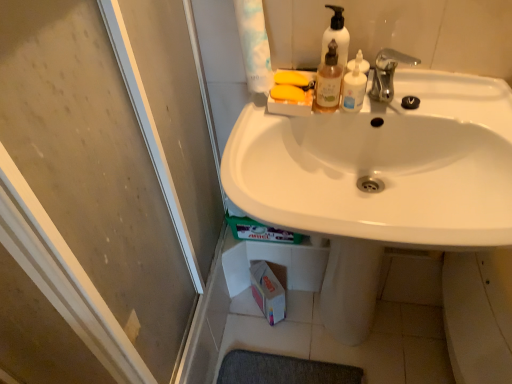
Describe the element at coordinates (254, 45) in the screenshot. I see `white glossy toilet paper at upper center` at that location.

Describe the element at coordinates (388, 73) in the screenshot. The image size is (512, 384). I see `silver metallic faucet at upper center` at that location.

Measure the distance between point [380,67] and camera.

The distance of point [380,67] from camera is 36.61 inches.

How much space does translucent plastic bottle at upper center, which appears as the second mouthwash when viewed from the right, occupy horizontally?

1.84 inches.

What is the approximate height of white plastic mouthwash at upper center, positioned as the first mouthwash in right-to-left order?

It is 3.99 inches.

This screenshot has width=512, height=384. What do you see at coordinates (101, 190) in the screenshot?
I see `transparent glass screen door at left` at bounding box center [101, 190].

What do you see at coordinates (336, 36) in the screenshot? I see `translucent plastic pump bottle at upper center` at bounding box center [336, 36].

The width and height of the screenshot is (512, 384). I want to click on white glossy toilet paper at upper center, so click(x=254, y=45).

From the image's perspective, which object appears higher, white glossy sink at center or white glossy toilet paper at upper center?

white glossy toilet paper at upper center is shown above in the image.

Who is taller, white glossy sink at center or white glossy toilet paper at upper center?

white glossy sink at center.

From a real-world perspective, is white glossy sink at center on top of white glossy toilet paper at upper center?

No.

Visually, is white glossy sink at center positioned to the left or to the right of white glossy toilet paper at upper center?

white glossy sink at center is positioned on white glossy toilet paper at upper center's right side.

Can you confirm if white glossy sink at center is bigger than translucent plastic pump bottle at upper center?

Yes.

Which object is thinner, white glossy sink at center or translucent plastic pump bottle at upper center?

translucent plastic pump bottle at upper center.

Considering the positions of points (381, 142) and (340, 15), is point (381, 142) closer to camera compared to point (340, 15)?

No.

Which object is positioned more to the left, white glossy sink at center or translucent plastic pump bottle at upper center?

translucent plastic pump bottle at upper center is more to the left.

From the picture: From the image's perspective, who appears lower, translucent plastic pump bottle at upper center or white plastic mouthwash at upper center, positioned as the first mouthwash in right-to-left order?

white plastic mouthwash at upper center, positioned as the first mouthwash in right-to-left order, appears lower in the image.

In terms of size, does translucent plastic pump bottle at upper center appear bigger or smaller than white plastic mouthwash at upper center, positioned as the first mouthwash in right-to-left order?

In the image, translucent plastic pump bottle at upper center appears to be larger than white plastic mouthwash at upper center, positioned as the first mouthwash in right-to-left order.

Which point is more forward, (325, 6) or (357, 88)?

The point (357, 88) is in front.

In terms of width, does translucent plastic pump bottle at upper center look wider or thinner when compared to white plastic mouthwash at upper center, which is the 2th mouthwash from left to right?

Considering their sizes, translucent plastic pump bottle at upper center looks broader than white plastic mouthwash at upper center, which is the 2th mouthwash from left to right.

Is translucent plastic bottle at upper center, which is the first mouthwash in left-to-right order, wider or thinner than transparent glass screen door at left?

Clearly, translucent plastic bottle at upper center, which is the first mouthwash in left-to-right order, has less width compared to transparent glass screen door at left.

Which object is closer to the camera taking this photo, translucent plastic bottle at upper center, which appears as the second mouthwash when viewed from the right, or transparent glass screen door at left?

transparent glass screen door at left is more forward.

The height and width of the screenshot is (384, 512). What are the coordinates of `screen door below the translucent plastic bottle at upper center, which is the first mouthwash in left-to-right order (from a real-world perspective)` in the screenshot? It's located at (101, 190).

Which of these two, translucent plastic bottle at upper center, which appears as the second mouthwash when viewed from the right, or transparent glass screen door at left, is smaller?

Smaller between the two is translucent plastic bottle at upper center, which appears as the second mouthwash when viewed from the right.

Looking at this image, which of these two, transparent glass screen door at left or translucent plastic pump bottle at upper center, is wider?

transparent glass screen door at left is wider.

Identify the location of screen door on the left side of translucent plastic pump bottle at upper center. This screenshot has width=512, height=384. (101, 190).

Considering the sizes of transparent glass screen door at left and translucent plastic pump bottle at upper center in the image, is transparent glass screen door at left taller or shorter than translucent plastic pump bottle at upper center?

Considering their sizes, transparent glass screen door at left has more height than translucent plastic pump bottle at upper center.

Identify the location of soap dispenser that appears above the translucent plastic bottle at upper center, which appears as the second mouthwash when viewed from the right (from the image's perspective). (336, 36).

Considering the relative sizes of translucent plastic pump bottle at upper center and translucent plastic bottle at upper center, which appears as the second mouthwash when viewed from the right, in the image provided, is translucent plastic pump bottle at upper center smaller than translucent plastic bottle at upper center, which appears as the second mouthwash when viewed from the right,?

Actually, translucent plastic pump bottle at upper center might be larger than translucent plastic bottle at upper center, which appears as the second mouthwash when viewed from the right.

From a real-world perspective, which is physically above, translucent plastic pump bottle at upper center or translucent plastic bottle at upper center, which appears as the second mouthwash when viewed from the right?

translucent plastic pump bottle at upper center.

Is translucent plastic pump bottle at upper center directly adjacent to translucent plastic bottle at upper center, which is the first mouthwash in left-to-right order?

Yes, translucent plastic pump bottle at upper center is right next to translucent plastic bottle at upper center, which is the first mouthwash in left-to-right order, and making contact.

Is translucent plastic pump bottle at upper center to the left or to the right of white glossy toilet paper at upper center in the image?

From the image, it's evident that translucent plastic pump bottle at upper center is to the right of white glossy toilet paper at upper center.

Who is shorter, translucent plastic pump bottle at upper center or white glossy toilet paper at upper center?

translucent plastic pump bottle at upper center.

Does point (331, 32) appear closer or farther from the camera than point (253, 47)?

Clearly, point (331, 32) is more distant from the camera than point (253, 47).

Identify the location of soap dispenser behind the white glossy toilet paper at upper center. Image resolution: width=512 pixels, height=384 pixels. (336, 36).

Locate an element on the screen. Image resolution: width=512 pixels, height=384 pixels. toilet paper above the white glossy sink at center (from a real-world perspective) is located at coordinates (254, 45).

Identify the location of soap dispenser on the left of white glossy sink at center. (336, 36).

Which object lies further to the anchor point silver metallic faucet at upper center, white glossy sink at center or transparent glass screen door at left?

transparent glass screen door at left.

Looking at this image, which object lies nearer to the anchor point white glossy toilet paper at upper center, transparent glass screen door at left or silver metallic faucet at upper center?

silver metallic faucet at upper center.

Estimate the real-world distances between objects in this image. Which object is further from white glossy toilet paper at upper center, translucent plastic pump bottle at upper center or white plastic mouthwash at upper center, positioned as the first mouthwash in right-to-left order?

white plastic mouthwash at upper center, positioned as the first mouthwash in right-to-left order, lies further to white glossy toilet paper at upper center than the other object.

When comparing their distances from silver metallic faucet at upper center, does white glossy toilet paper at upper center or transparent glass screen door at left seem closer?

white glossy toilet paper at upper center.

From the image, which object appears to be nearer to translucent plastic bottle at upper center, which is the first mouthwash in left-to-right order, transparent glass screen door at left or translucent plastic pump bottle at upper center?

translucent plastic pump bottle at upper center is closer to translucent plastic bottle at upper center, which is the first mouthwash in left-to-right order.

Estimate the real-world distances between objects in this image. Which object is further from white glossy toilet paper at upper center, transparent glass screen door at left or translucent plastic bottle at upper center, which is the first mouthwash in left-to-right order?

transparent glass screen door at left lies further to white glossy toilet paper at upper center than the other object.

Estimate the real-world distances between objects in this image. Which object is further from white plastic mouthwash at upper center, positioned as the first mouthwash in right-to-left order, white glossy toilet paper at upper center or translucent plastic pump bottle at upper center?

white glossy toilet paper at upper center lies further to white plastic mouthwash at upper center, positioned as the first mouthwash in right-to-left order, than the other object.

Which object lies further to the anchor point white plastic mouthwash at upper center, positioned as the first mouthwash in right-to-left order, white glossy toilet paper at upper center or white glossy sink at center?

white glossy sink at center is further to white plastic mouthwash at upper center, positioned as the first mouthwash in right-to-left order.

Identify the location of toilet paper between transparent glass screen door at left and translucent plastic bottle at upper center, which is the first mouthwash in left-to-right order, along the z-axis. (254, 45).

This screenshot has width=512, height=384. I want to click on mouthwash between translucent plastic pump bottle at upper center and white plastic mouthwash at upper center, which is the 2th mouthwash from left to right, in the vertical direction, so click(x=328, y=81).

The height and width of the screenshot is (384, 512). I want to click on sink between transparent glass screen door at left and silver metallic faucet at upper center from left to right, so click(380, 180).

Locate an element on the screen. Image resolution: width=512 pixels, height=384 pixels. toilet paper between transparent glass screen door at left and white plastic mouthwash at upper center, which is the 2th mouthwash from left to right, in the front-back direction is located at coordinates 254,45.